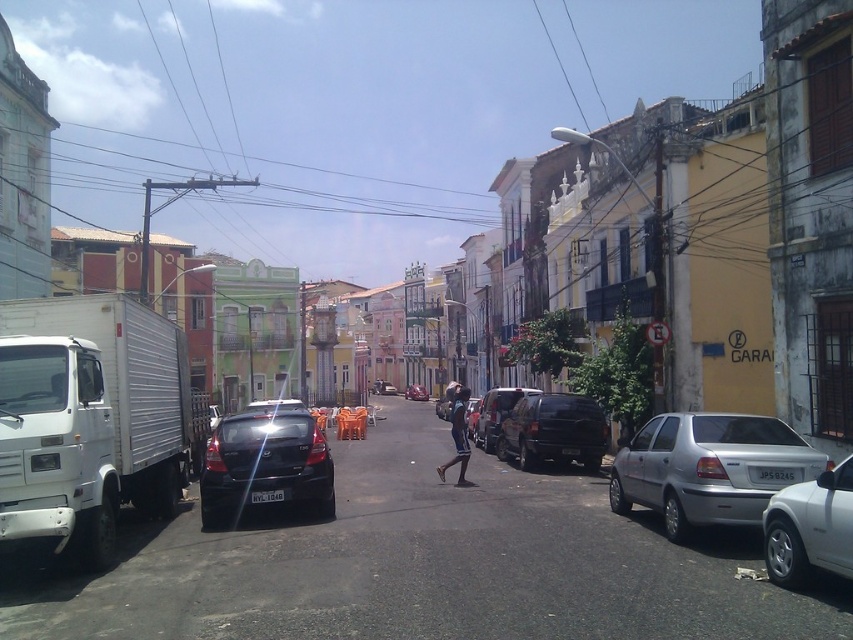
Is shiny black van at center thinner than shiny black suv at center?

Yes.

Who is more forward, (527,467) or (486,449)?

Point (527,467) is in front.

Where is `shiny black van at center`? This screenshot has width=853, height=640. shiny black van at center is located at coordinates (553, 429).

Measure the distance between silver metallic sedan at center-right and camera.

They are 27.20 feet apart.

Between silver metallic sedan at center-right and shiny black sedan at center, which one has more height?

shiny black sedan at center is taller.

Between point (680, 436) and point (251, 412), which one is positioned behind?

Positioned behind is point (251, 412).

Find the location of a particular element. silver metallic sedan at center-right is located at coordinates (709, 468).

Is silver metallic sedan at center-right positioned before dark blue fabric pants at center?

Yes.

Between point (653, 428) and point (461, 483), which one is positioned behind?

The point (461, 483) is more distant.

At what (x,y) coordinates should I click in order to perform the action: click on silver metallic sedan at center-right. Please return your answer as a coordinate pair (x, y). This screenshot has width=853, height=640. Looking at the image, I should click on (709, 468).